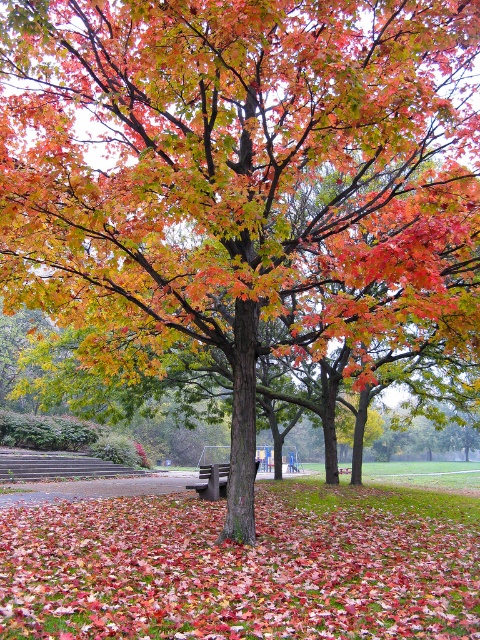
Is the position of fallen leaves at center less distant than that of wooden bench at center?

That is True.

Image resolution: width=480 pixels, height=640 pixels. What do you see at coordinates (243, 566) in the screenshot? I see `fallen leaves at center` at bounding box center [243, 566].

Image resolution: width=480 pixels, height=640 pixels. Identify the location of fallen leaves at center. (243, 566).